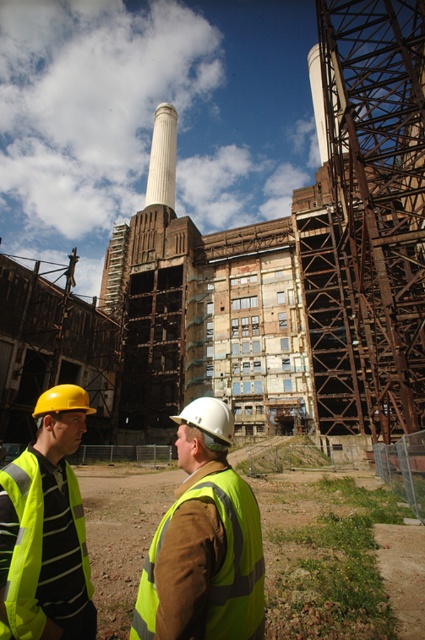
Can you confirm if high-visibility fabric safety vest at center is shorter than yellow reflective safety vest at lower left?

Correct, high-visibility fabric safety vest at center is not as tall as yellow reflective safety vest at lower left.

Which is more to the left, high-visibility fabric safety vest at center or yellow reflective safety vest at lower left?

yellow reflective safety vest at lower left is more to the left.

Is point (155, 540) positioned behind point (19, 474)?

Yes, point (155, 540) is farther from viewer.

Identify the location of high-visibility fabric safety vest at center. (221, 564).